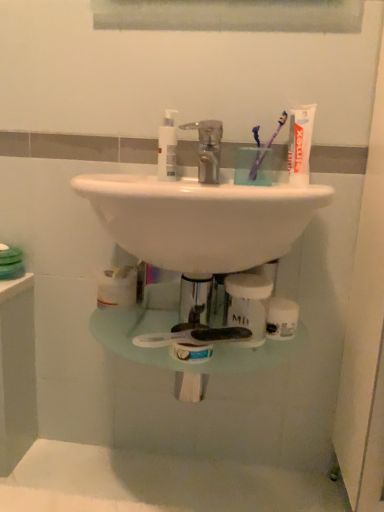
Question: Is white glossy sink at center thinner than clear plastic jar at center, acting as the 1th toiletry starting from the bottom?

Choices:
 (A) yes
 (B) no

Answer: (B)

Question: From the image's perspective, is white glossy sink at center below clear plastic jar at center, which is the second toiletry from left to right?

Choices:
 (A) yes
 (B) no

Answer: (B)

Question: From a real-world perspective, is white glossy sink at center located beneath clear plastic jar at center, which is the second toiletry from left to right?

Choices:
 (A) yes
 (B) no

Answer: (B)

Question: Is white glossy sink at center not near clear plastic jar at center, which is the second toiletry from left to right?

Choices:
 (A) yes
 (B) no

Answer: (B)

Question: Is clear plastic jar at center, acting as the 1th toiletry starting from the bottom, at the back of white glossy sink at center?

Choices:
 (A) yes
 (B) no

Answer: (B)

Question: Relative to white glossy sink at center, is white matte tube of toothpaste at upper right in front or behind?

Choices:
 (A) behind
 (B) front

Answer: (A)

Question: Is white matte tube of toothpaste at upper right taller or shorter than white glossy sink at center?

Choices:
 (A) short
 (B) tall

Answer: (A)

Question: Is white matte tube of toothpaste at upper right spatially inside white glossy sink at center, or outside of it?

Choices:
 (A) inside
 (B) outside

Answer: (B)

Question: Looking at their shapes, would you say white matte tube of toothpaste at upper right is wider or thinner than white glossy sink at center?

Choices:
 (A) wide
 (B) thin

Answer: (B)

Question: Is white matte tube of toothpaste at upper right in front of or behind white plastic pump bottle at center, which is counted as the 1th toiletry, starting from the left, in the image?

Choices:
 (A) front
 (B) behind

Answer: (A)

Question: From a real-world perspective, is white matte tube of toothpaste at upper right physically located above or below white plastic pump bottle at center, which is counted as the 1th toiletry, starting from the left?

Choices:
 (A) below
 (B) above

Answer: (B)

Question: From the image's perspective, is white matte tube of toothpaste at upper right positioned above or below white plastic pump bottle at center, which is counted as the 1th toiletry, starting from the left?

Choices:
 (A) above
 (B) below

Answer: (B)

Question: Considering the relative positions of white matte tube of toothpaste at upper right and white plastic pump bottle at center, which is counted as the 1th toiletry, starting from the left, in the image provided, is white matte tube of toothpaste at upper right to the left or to the right of white plastic pump bottle at center, which is counted as the 1th toiletry, starting from the left,?

Choices:
 (A) right
 (B) left

Answer: (A)

Question: From a real-world perspective, is white matte tube of toothpaste at upper right above or below polished chrome faucet at center?

Choices:
 (A) below
 (B) above

Answer: (B)

Question: Is white matte tube of toothpaste at upper right inside the boundaries of polished chrome faucet at center, or outside?

Choices:
 (A) inside
 (B) outside

Answer: (B)